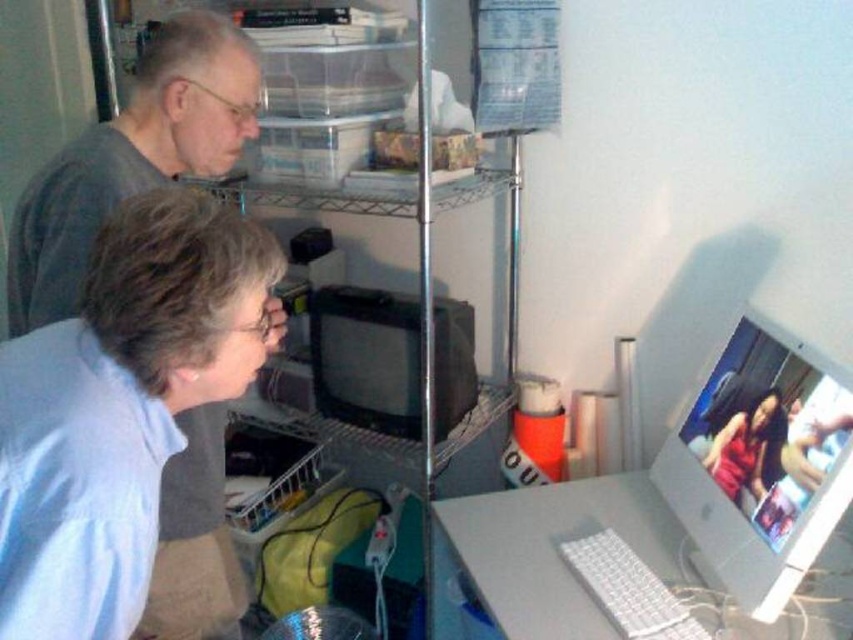
In the scene shown: Measure the distance between gray plastic computer desk at lower right and camera.

The distance of gray plastic computer desk at lower right from camera is 1.23 meters.

Between gray plastic computer desk at lower right and gray matte shirt at upper left, which one is positioned higher?

gray matte shirt at upper left is higher up.

Is point (537, 506) farther from camera compared to point (143, 120)?

Yes.

The width and height of the screenshot is (853, 640). I want to click on gray plastic computer desk at lower right, so click(628, 547).

Is gray matte shirt at upper left bigger than black plastic monitor at center?

Indeed, gray matte shirt at upper left has a larger size compared to black plastic monitor at center.

Is point (90, 166) farther from camera compared to point (439, 344)?

No, (90, 166) is closer to viewer.

Find the location of `gray matte shirt at upper left`. gray matte shirt at upper left is located at coordinates (132, 157).

Can you confirm if matte gray shirt at left is thinner than black plastic monitor at center?

Correct, matte gray shirt at left's width is less than black plastic monitor at center's.

Who is more distant from viewer, (256,100) or (386,412)?

Positioned behind is point (386,412).

The image size is (853, 640). I want to click on matte gray shirt at left, so click(x=132, y=156).